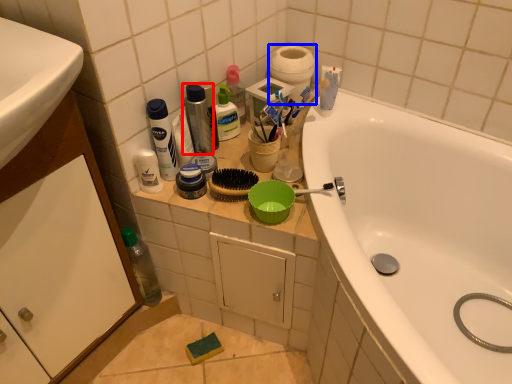
Question: Which object is closer to the camera taking this photo, cleaning product (highlighted by a red box) or toilet paper (highlighted by a blue box)?

Choices:
 (A) cleaning product
 (B) toilet paper

Answer: (A)